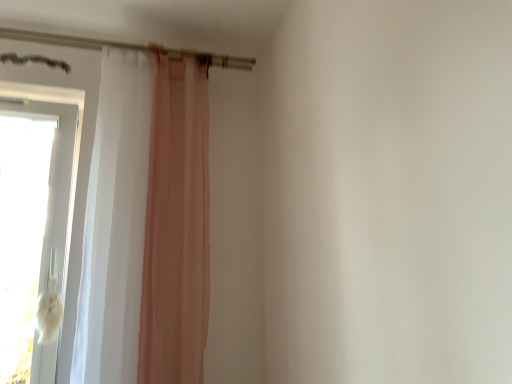
This screenshot has height=384, width=512. Find the location of `sheer white curtain at left`. sheer white curtain at left is located at coordinates (115, 223).

What do you see at coordinates (115, 223) in the screenshot? I see `sheer white curtain at left` at bounding box center [115, 223].

In order to face sheer white curtain at left, should I rotate leftwards or rightwards?

To face it directly, rotate left by 13.986 degrees.

This screenshot has width=512, height=384. What do you see at coordinates (79, 152) in the screenshot?
I see `white glossy door at left` at bounding box center [79, 152].

Locate an element on the screen. white glossy door at left is located at coordinates (79, 152).

The image size is (512, 384). Identify the location of sheer white curtain at left. (115, 223).

Would you say sheer white curtain at left is to the left or to the right of white glossy door at left in the picture?

In the image, sheer white curtain at left appears on the right side of white glossy door at left.

Does sheer white curtain at left come behind white glossy door at left?

No, the depth of sheer white curtain at left is less than that of white glossy door at left.

Which point is more distant from viewer, (115, 260) or (18, 77)?

The point (18, 77) is farther from the camera.

From the image's perspective, is sheer white curtain at left over white glossy door at left?

Correct, sheer white curtain at left appears higher than white glossy door at left in the image.

From a real-world perspective, which object rests below the other?

white glossy door at left, from a real-world perspective.

Is sheer white curtain at left wider than white glossy door at left?

In fact, sheer white curtain at left might be narrower than white glossy door at left.

Considering the sizes of sheer white curtain at left and white glossy door at left in the image, is sheer white curtain at left taller or shorter than white glossy door at left?

sheer white curtain at left is taller than white glossy door at left.

In terms of size, does sheer white curtain at left appear bigger or smaller than white glossy door at left?

Considering their sizes, sheer white curtain at left takes up more space than white glossy door at left.

Is sheer white curtain at left completely or partially outside of white glossy door at left?

Yes, sheer white curtain at left is outside of white glossy door at left.

Is there a large distance between sheer white curtain at left and white glossy door at left?

No, sheer white curtain at left is not far from white glossy door at left.

From the picture: Is sheer white curtain at left oriented away from white glossy door at left?

No, sheer white curtain at left is not facing away from white glossy door at left.

How many degrees apart are the facing directions of sheer white curtain at left and white glossy door at left?

There is a 0.000562-degree angle between the facing directions of sheer white curtain at left and white glossy door at left.

The height and width of the screenshot is (384, 512). I want to click on shower curtain in front of the white glossy door at left, so click(x=115, y=223).

Between white glossy door at left and sheer white curtain at left, which one appears on the left side from the viewer's perspective?

From the viewer's perspective, white glossy door at left appears more on the left side.

Which object is more forward, white glossy door at left or sheer white curtain at left?

Positioned in front is sheer white curtain at left.

Is point (61, 84) positioned in front of point (141, 103)?

No, it is behind (141, 103).

From the image's perspective, is white glossy door at left on top of sheer white curtain at left?

Incorrect, from the image's perspective, white glossy door at left is lower than sheer white curtain at left.

From a real-world perspective, is white glossy door at left physically above sheer white curtain at left?

Actually, white glossy door at left is physically below sheer white curtain at left in the real world.

Is white glossy door at left wider or thinner than sheer white curtain at left?

In the image, white glossy door at left appears to be wider than sheer white curtain at left.

Considering the sizes of white glossy door at left and sheer white curtain at left in the image, is white glossy door at left taller or shorter than sheer white curtain at left?

In the image, white glossy door at left appears to be shorter than sheer white curtain at left.

Can you confirm if white glossy door at left is smaller than sheer white curtain at left?

Indeed, white glossy door at left has a smaller size compared to sheer white curtain at left.

Is white glossy door at left inside or outside of sheer white curtain at left?

white glossy door at left is not enclosed by sheer white curtain at left.

Is there a large distance between white glossy door at left and sheer white curtain at left?

No, white glossy door at left is in close proximity to sheer white curtain at left.

Is sheer white curtain at left at the back of white glossy door at left?

white glossy door at left does not have its back to sheer white curtain at left.

The height and width of the screenshot is (384, 512). Find the location of `door located on the left of sheer white curtain at left`. door located on the left of sheer white curtain at left is located at coordinates (79, 152).

Locate an element on the screen. Image resolution: width=512 pixels, height=384 pixels. shower curtain lying above the white glossy door at left (from the image's perspective) is located at coordinates (115, 223).

I want to click on door on the left of sheer white curtain at left, so click(x=79, y=152).